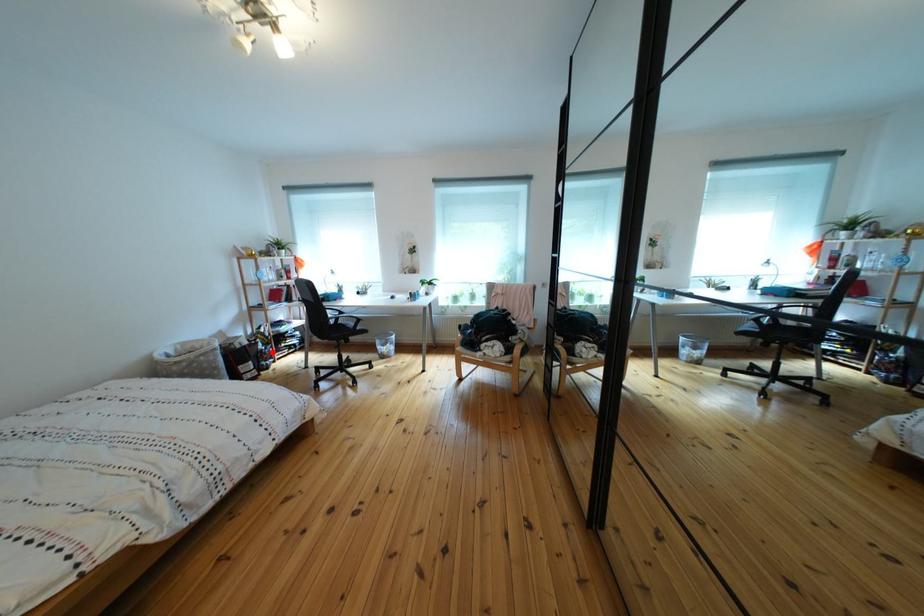
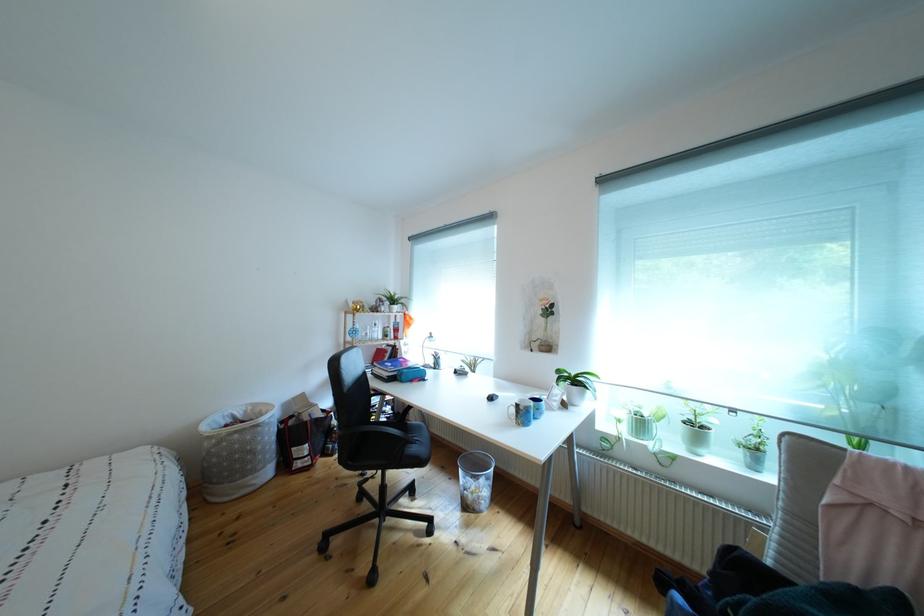
Question: I am providing you with two images of the same scene from different viewpoints. Image1 has a red point marked. In image2, the corresponding 3D location appears at what relative position? Reply with the corresponding letter.

Choices:
 (A) Closer
 (B) Farther

Answer: (B)